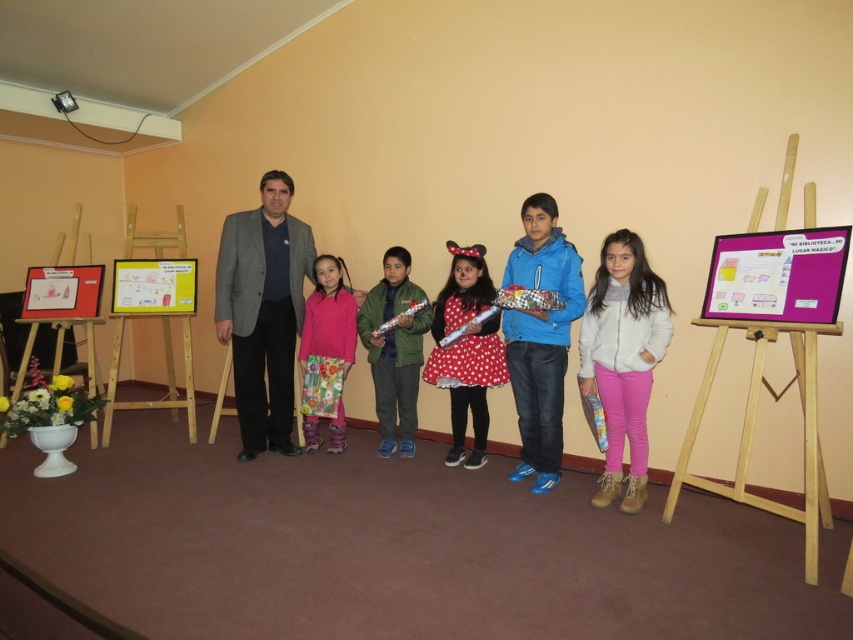
Question: Is blue matte jacket at center further to camera compared to green matte jacket at center?

Choices:
 (A) no
 (B) yes

Answer: (A)

Question: Which object is the closest to the fluffy pink sweater at center?

Choices:
 (A) white suede jacket at center
 (B) wooden easel at right
 (C) yellow paperboard at left

Answer: (C)

Question: Which point is closer to the camera?

Choices:
 (A) green matte jacket at center
 (B) white suede jacket at center

Answer: (B)

Question: Is blue matte jacket at center to the right of fluffy pink sweater at center from the viewer's perspective?

Choices:
 (A) no
 (B) yes

Answer: (B)

Question: Which of the following is the farthest from the observer?

Choices:
 (A) red polka dot dress at center
 (B) gray woolen suit at center

Answer: (B)

Question: Does blue matte jacket at center lie behind wooden easel at right?

Choices:
 (A) yes
 (B) no

Answer: (A)